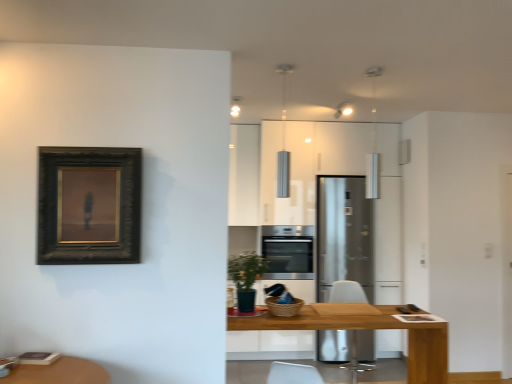
Find the location of `dark wood frame at upper left`. dark wood frame at upper left is located at coordinates pos(89,205).

Image resolution: width=512 pixels, height=384 pixels. What do you see at coordinates (369, 328) in the screenshot? I see `wooden table at center` at bounding box center [369, 328].

Image resolution: width=512 pixels, height=384 pixels. What do you see at coordinates (288, 251) in the screenshot?
I see `satin silver oven at center` at bounding box center [288, 251].

The image size is (512, 384). What do you see at coordinates (347, 292) in the screenshot? I see `white plastic swivel chair at center` at bounding box center [347, 292].

The height and width of the screenshot is (384, 512). What are the coordinates of `white plastic swivel chair at center` in the screenshot? It's located at (347, 292).

Where is `satin silver refrigerator at center`? This screenshot has height=384, width=512. satin silver refrigerator at center is located at coordinates (344, 235).

From the image's perspective, between wooden table at center and white plastic swivel chair at center, which one is located above?

From the image's view, wooden table at center is above.

Is wooden table at center aimed at white plastic swivel chair at center?

Yes.

Is wooden table at center to the right of white plastic swivel chair at center from the viewer's perspective?

No.

From a real-world perspective, between wooden table at center and white plastic swivel chair at center, who is vertically higher?

wooden table at center is physically above.

Is wooden table at center wider or thinner than dark wood frame at upper left?

Clearly, wooden table at center has more width compared to dark wood frame at upper left.

Which object is further away from the camera taking this photo, wooden table at center or dark wood frame at upper left?

wooden table at center is further away from the camera.

Can you confirm if wooden table at center is positioned to the right of dark wood frame at upper left?

Yes, wooden table at center is to the right of dark wood frame at upper left.

In the scene shown: Would you say satin silver oven at center is outside white plastic swivel chair at center?

satin silver oven at center lies outside white plastic swivel chair at center's area.

Which is closer to the camera, (275, 258) or (352, 343)?

Point (275, 258).

Looking at this image, is satin silver oven at center smaller than white plastic swivel chair at center?

No.

From the picture: Between satin silver oven at center and white plastic swivel chair at center, which one has less height?

satin silver oven at center.

Would you say satin silver refrigerator at center contains white plastic swivel chair at center?

No.

Is satin silver refrigerator at center bigger or smaller than white plastic swivel chair at center?

satin silver refrigerator at center is bigger than white plastic swivel chair at center.

Can you confirm if satin silver refrigerator at center is positioned to the right of white plastic swivel chair at center?

Yes.

Who is taller, satin silver refrigerator at center or dark wood frame at upper left?

satin silver refrigerator at center is taller.

Measure the distance between satin silver refrigerator at center and dark wood frame at upper left.

satin silver refrigerator at center and dark wood frame at upper left are 2.71 meters apart from each other.

The width and height of the screenshot is (512, 384). I want to click on fridge located on the right of dark wood frame at upper left, so click(x=344, y=235).

Can you confirm if wooden table at center is shorter than satin silver oven at center?

No.

Considering the positions of points (437, 356) and (282, 242), is point (437, 356) closer to camera compared to point (282, 242)?

That is True.

Is satin silver oven at center a part of wooden table at center?

No, satin silver oven at center is not a part of wooden table at center.

Visually, is wooden table at center positioned to the left or to the right of satin silver oven at center?

In the image, wooden table at center appears on the right side of satin silver oven at center.

Would you say wooden table at center is inside or outside satin silver refrigerator at center?

wooden table at center is not inside satin silver refrigerator at center, it's outside.

Is wooden table at center to the left of satin silver refrigerator at center from the viewer's perspective?

Yes.

Is wooden table at center turned away from satin silver refrigerator at center?

That's not correct — wooden table at center is not looking away from satin silver refrigerator at center.

Who is bigger, wooden table at center or satin silver refrigerator at center?

Bigger between the two is satin silver refrigerator at center.

Find the location of `table in front of the white plastic swivel chair at center`. table in front of the white plastic swivel chair at center is located at coordinates (369, 328).

Find the location of a particular element. table below the dark wood frame at upper left (from a real-world perspective) is located at coordinates (369, 328).

Estimate the real-world distances between objects in this image. Which object is closer to wooden table at center, dark wood frame at upper left or satin silver refrigerator at center?

Among the two, dark wood frame at upper left is located nearer to wooden table at center.

When comparing their distances from satin silver refrigerator at center, does satin silver oven at center or wooden table at center seem further?

wooden table at center.

Which object lies further to the anchor point dark wood frame at upper left, satin silver oven at center or wooden table at center?

The object further to dark wood frame at upper left is satin silver oven at center.

When comparing their distances from white plastic swivel chair at center, does satin silver oven at center or wooden table at center seem closer?

satin silver oven at center.

From the image, which object appears to be nearer to satin silver refrigerator at center, wooden table at center or satin silver oven at center?

satin silver oven at center lies closer to satin silver refrigerator at center than the other object.

When comparing their distances from dark wood frame at upper left, does satin silver refrigerator at center or wooden table at center seem further?

Based on the image, satin silver refrigerator at center appears to be further to dark wood frame at upper left.

Which object lies nearer to the anchor point white plastic swivel chair at center, satin silver refrigerator at center or wooden table at center?

satin silver refrigerator at center is positioned closer to the anchor white plastic swivel chair at center.

Based on their spatial positions, is dark wood frame at upper left or satin silver refrigerator at center further from satin silver oven at center?

dark wood frame at upper left lies further to satin silver oven at center than the other object.

Identify the location of swivel chair positioned between wooden table at center and satin silver refrigerator at center from near to far. (347, 292).

You are a GUI agent. You are given a task and a screenshot of the screen. Output one action in this format:
    pyautogui.click(x=<x>, y=<y>)
    Task: Click on the fridge between white plastic swivel chair at center and satin silver oven at center from front to back
    This screenshot has height=384, width=512.
    Given the screenshot: What is the action you would take?
    pyautogui.click(x=344, y=235)

Where is `table between dark wood frame at upper left and satin silver refrigerator at center from front to back`? The height and width of the screenshot is (384, 512). table between dark wood frame at upper left and satin silver refrigerator at center from front to back is located at coordinates (369, 328).

Identify the location of swivel chair positioned between dark wood frame at upper left and satin silver oven at center from near to far. (347, 292).